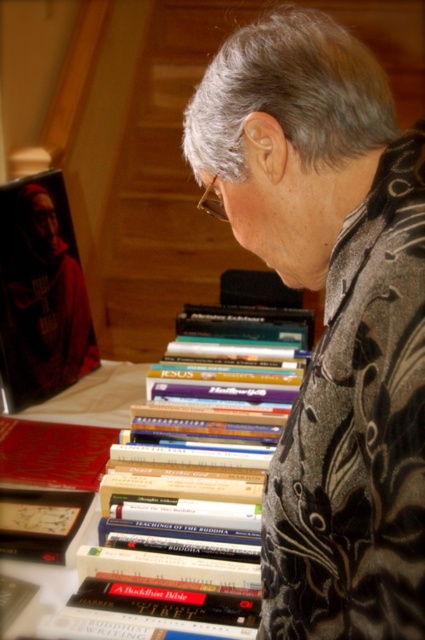
You are a photographer trying to capture the scene of the person examining religious books. You want to ensure that both points, point (40, 346) and point (198, 204), are in focus. Which point should you focus on first to ensure both are sharp?

You should focus on point (198, 204) first because it is closer to the camera than point (40, 346). By focusing on the closer point, the further point will also be within the depth of field, ensuring both are sharp.

From the picture: You are a librarian who needs to place a 24 inch long object between the matte black book at left and the clear plastic glasses at upper center. Can you fit it there?

The distance between the matte black book at left and the clear plastic glasses at upper center is 22.42 inches, so the 24 inch long object cannot fit between them as it is longer than the available space.